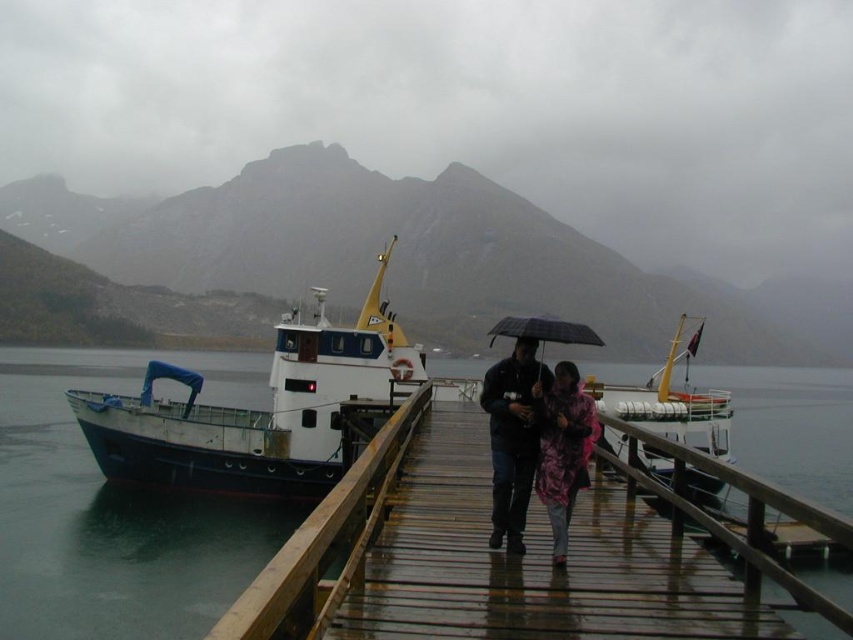
Question: Which of the following is the farthest from the observer?

Choices:
 (A) (518, 518)
 (B) (538, 333)
 (C) (379, 120)
 (D) (134, 451)

Answer: (C)

Question: Which point is farther to the camera?

Choices:
 (A) blue painted metal boat at center
 (B) black matte umbrella at center
 (C) wooden at center

Answer: (A)

Question: Can you confirm if wooden at center is positioned to the left of pink camouflage jacket at center?

Choices:
 (A) yes
 (B) no

Answer: (A)

Question: Can you confirm if wooden at center is positioned below blue painted metal boat at center?

Choices:
 (A) yes
 (B) no

Answer: (A)

Question: Which is farther from the blue painted metal boat at center?

Choices:
 (A) pink camouflage jacket at center
 (B) wooden at center
 (C) camouflage jacket at center

Answer: (A)

Question: Does wooden at center appear on the right side of pink camouflage jacket at center?

Choices:
 (A) no
 (B) yes

Answer: (A)